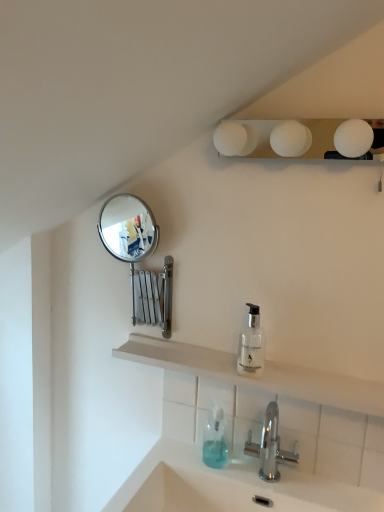
Locate an element on the screen. The width and height of the screenshot is (384, 512). empty space that is to the right of translucent plastic soap dispenser at lower center, the 2th soap dispenser positioned from the top is located at coordinates (280, 478).